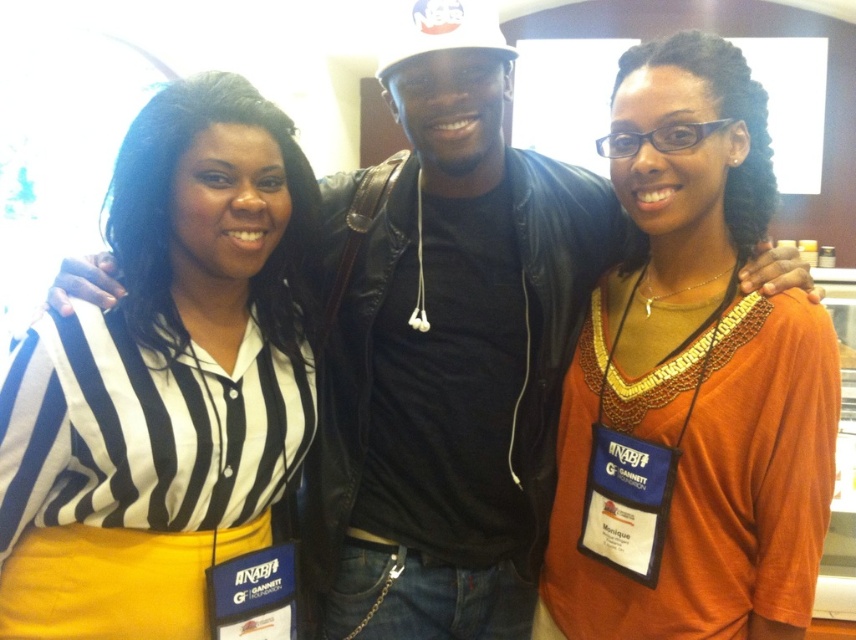
Question: Which point is farther to the camera?

Choices:
 (A) (15, 368)
 (B) (821, 449)

Answer: (B)

Question: Is the position of black striped shirt at left less distant than that of orange fabric shirt at center?

Choices:
 (A) yes
 (B) no

Answer: (A)

Question: Observing the image, what is the correct spatial positioning of black striped shirt at left in reference to orange fabric shirt at center?

Choices:
 (A) above
 (B) below

Answer: (A)

Question: Among these objects, which one is nearest to the camera?

Choices:
 (A) black striped shirt at left
 (B) orange fabric shirt at center

Answer: (A)

Question: Is black striped shirt at left closer to the viewer compared to orange fabric shirt at center?

Choices:
 (A) no
 (B) yes

Answer: (B)

Question: Which point is closer to the camera?

Choices:
 (A) (140, 115)
 (B) (550, 532)

Answer: (A)